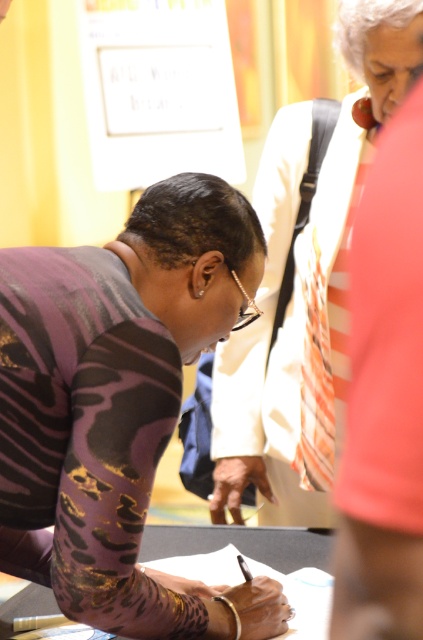
You are looking at the scene and notice two points marked in the image. The first point is at coordinate point(x=38, y=252) and the second is at point(x=353, y=132). Which point is closer to you?

Point(x=38, y=252) is closer to you than point(x=353, y=132).

What object is located at the coordinates point (307, 288) in the image?

The point (307, 288) corresponds to the matte purple blouse at center.

You are organizing a clothing display and need to arrange the purple metallic shirt at center and the matte purple blouse at center on a mannequin. Which one should you place first to ensure proper layering?

The purple metallic shirt at center is smaller than the matte purple blouse at center, so you should place the matte purple blouse at center first as it is larger and forms the base layer.